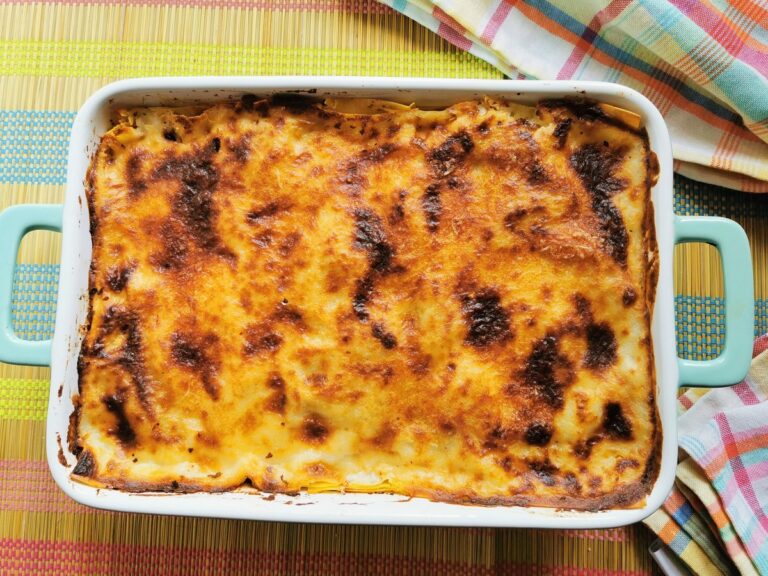
At what (x,y) coordinates should I click in order to perform the action: click on place where your fingers would go to hold pan. Please return your answer as a coordinate pair (x, y). This screenshot has width=768, height=576. Looking at the image, I should click on (707, 291), (41, 280).